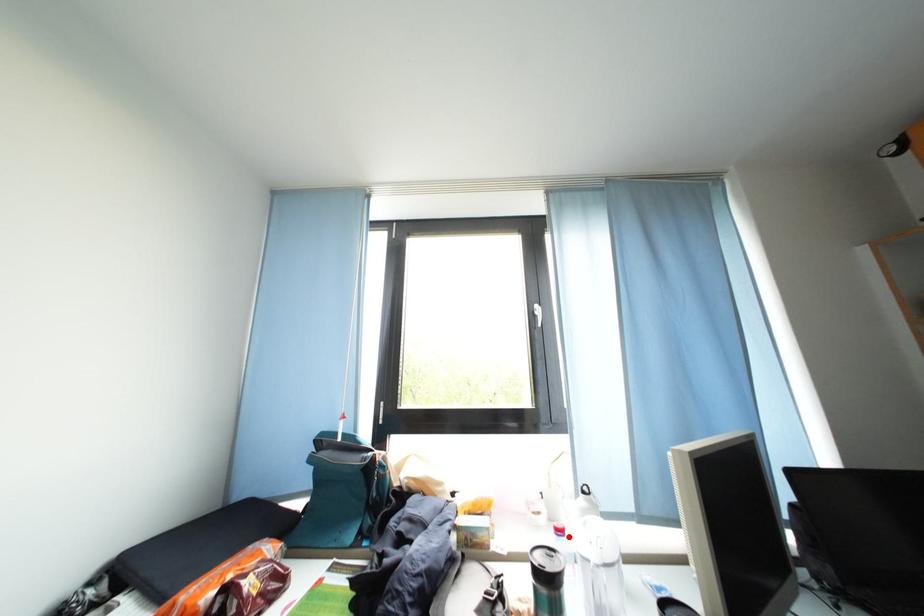
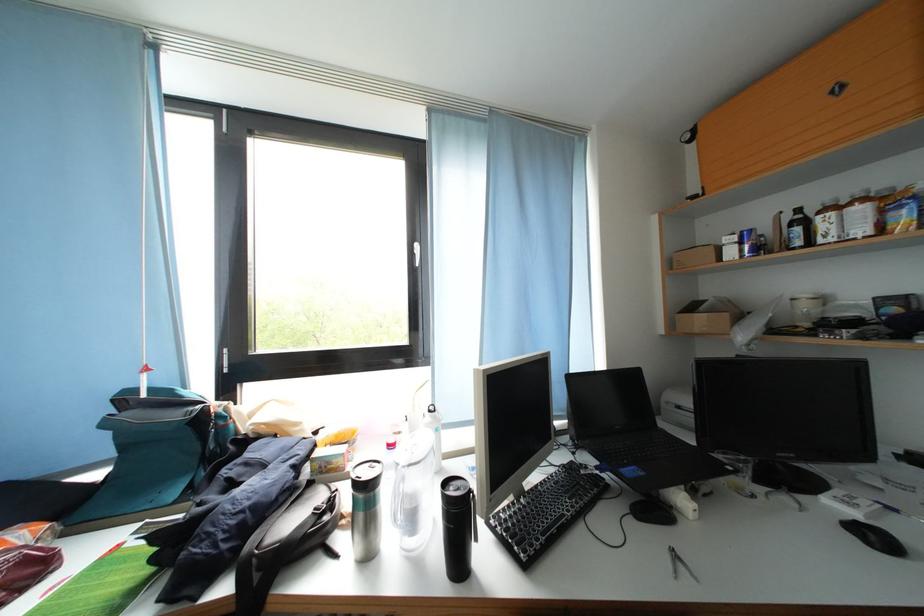
The point at the highlighted location is marked in the first image. Where is the corresponding point in the second image?

(398, 451)